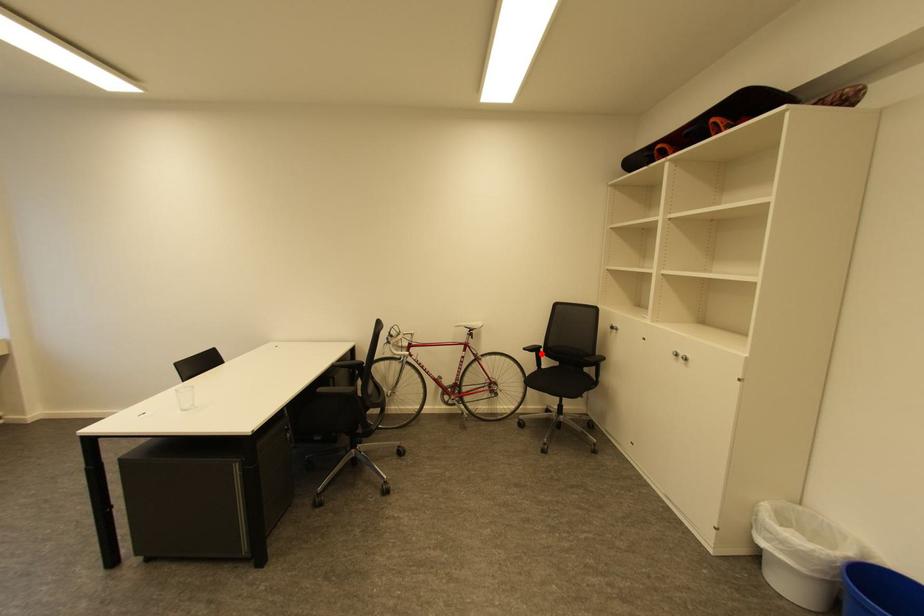
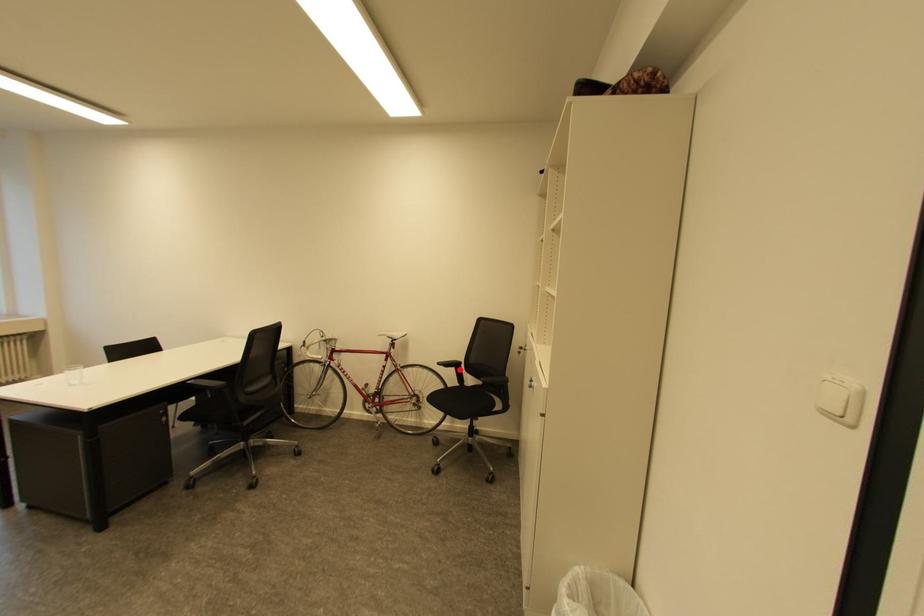
I am providing you with two images of the same scene from different viewpoints. A red point is marked on the first image and another point is marked on the second image. Is the red point in image1 aligned with the point shown in image2?

Yes